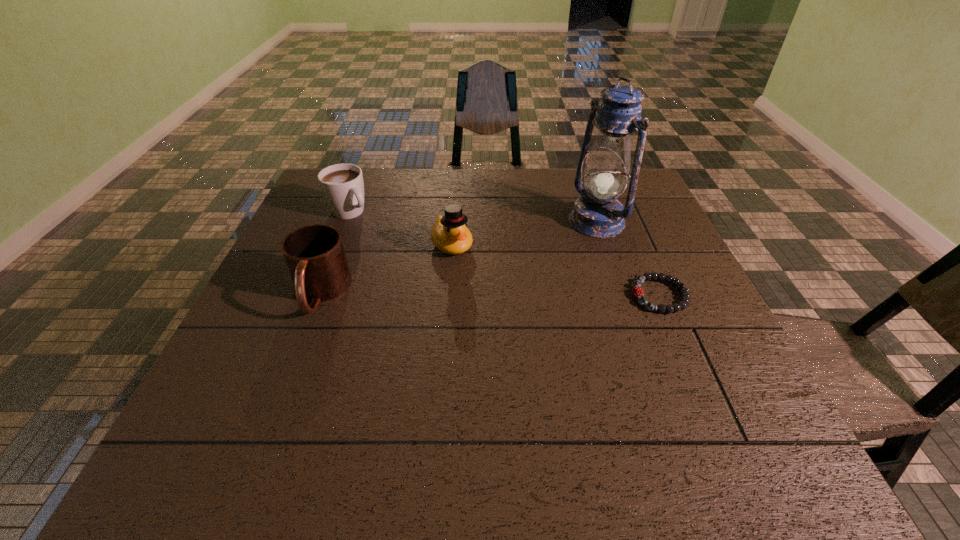
The height and width of the screenshot is (540, 960). In order to click on free space in the image that satisfies the following two spatial constraints: 1. on the side of the shortest object with the handle; 2. on the left side of the mug in this screenshot , I will do `click(320, 295)`.

I want to click on blank area in the image that satisfies the following two spatial constraints: 1. on the front side of the third object from right to left; 2. on the left side of the shortest object, so 448,295.